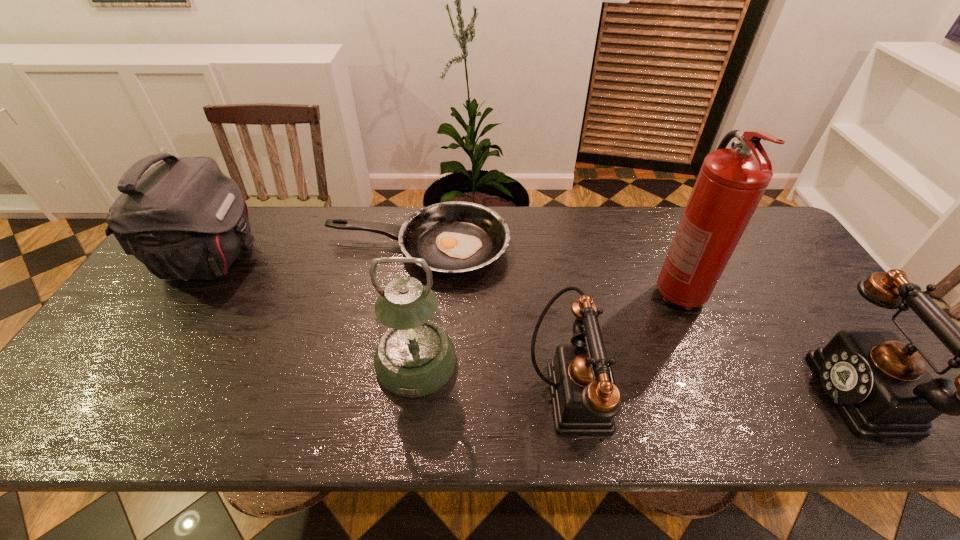
At what (x,y) coordinates should I click in order to perform the action: click on the shorter telephone. Please return your answer as a coordinate pair (x, y). The width and height of the screenshot is (960, 540). Looking at the image, I should click on (584, 396).

This screenshot has height=540, width=960. What are the coordinates of `the left telephone` in the screenshot? It's located at (584, 396).

Find the location of `the shortest object`. the shortest object is located at coordinates (456, 237).

Locate an element on the screen. This screenshot has height=540, width=960. the tallest object is located at coordinates (731, 182).

Locate an element on the screen. The height and width of the screenshot is (540, 960). the fifth object from left to right is located at coordinates (731, 182).

Locate an element on the screen. The height and width of the screenshot is (540, 960). shoulder bag is located at coordinates (184, 219).

Find the location of a particular element. The image size is (960, 540). lantern is located at coordinates (415, 357).

I want to click on vacant space located on the front of the left telephone at the rotary dial, so click(742, 394).

Locate an element on the screen. Image resolution: width=960 pixels, height=540 pixels. vacant space located on the left of the frying pan is located at coordinates (252, 247).

Where is `blank space located on the handle side the fifth object from left to right`? The height and width of the screenshot is (540, 960). blank space located on the handle side the fifth object from left to right is located at coordinates (701, 343).